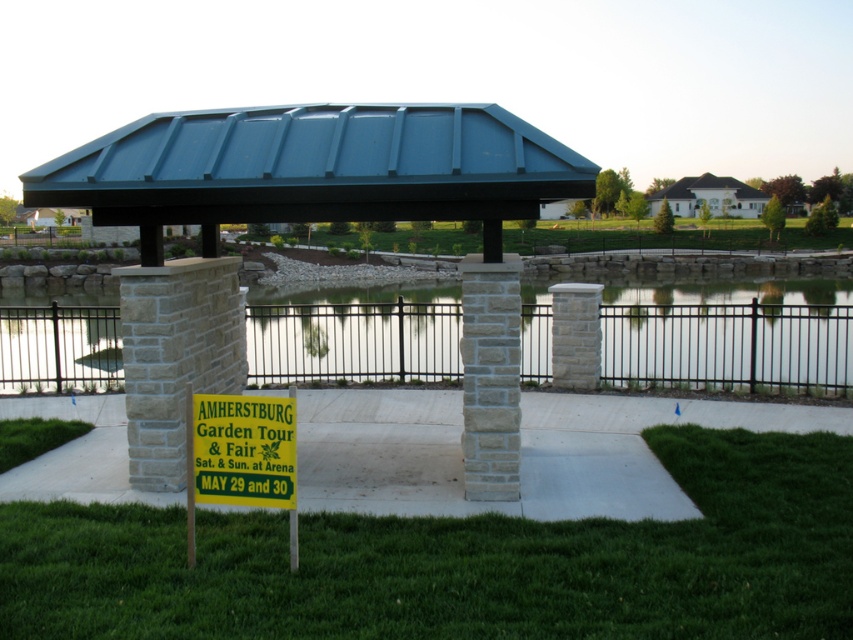
You are standing in the outdoor setting and see the clear glass water at center and the yellow paper sign at lower center. Which object is positioned to the left of the other?

The clear glass water at center is to the left of yellow paper sign at lower center.

You are standing in the garden and want to cross to the other side of the clear glass water at center. The metallic stone gazebo at center is in your way. Which direction should you walk to go around it?

Since the metallic stone gazebo at center is on the right side of the clear glass water at center, you should walk to the left side of the gazebo to reach the other side of the water.

You are standing at the edge of the water and want to walk towards the sign. Which direction should you move relative to the clear glass water at center to reach the green grass at lower center?

To reach the green grass at lower center, you should move to the right of the clear glass water at center since the green grass at lower center is positioned to the right of it.